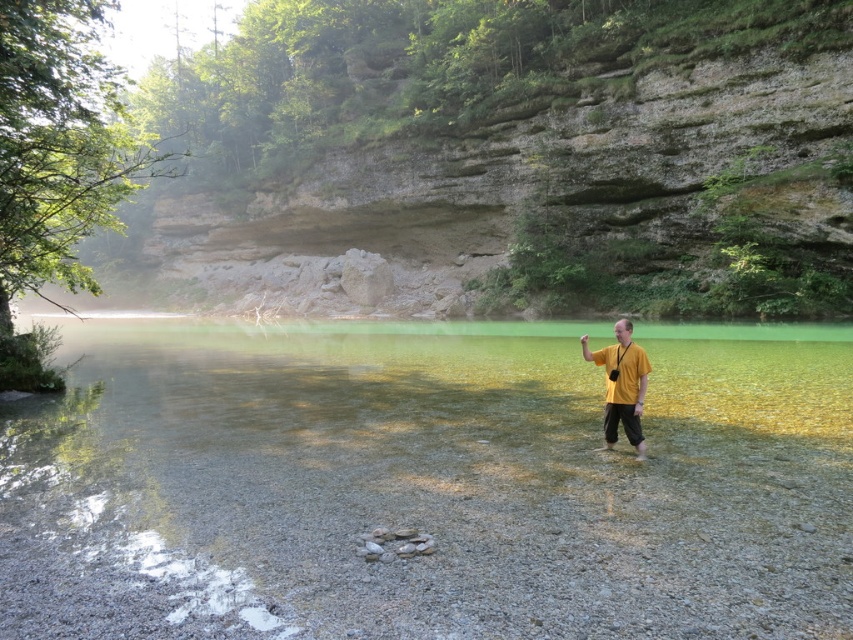
Question: Is clear glass lake at center smaller than yellow matte shirt at right?

Choices:
 (A) yes
 (B) no

Answer: (B)

Question: Among these points, which one is nearest to the camera?

Choices:
 (A) (643, 605)
 (B) (625, 340)

Answer: (A)

Question: Can you confirm if clear glass lake at center is wider than yellow matte shirt at right?

Choices:
 (A) yes
 (B) no

Answer: (A)

Question: Where is clear glass lake at center located in relation to yellow matte shirt at right in the image?

Choices:
 (A) below
 (B) above

Answer: (A)

Question: Which of the following is the farthest from the observer?

Choices:
 (A) (625, 435)
 (B) (573, 328)

Answer: (B)